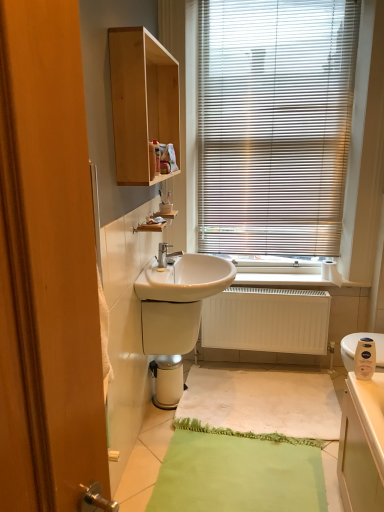
What are the coordinates of `free spot below silver metallic tap at center (from a real-world perspective)` in the screenshot? It's located at (164, 269).